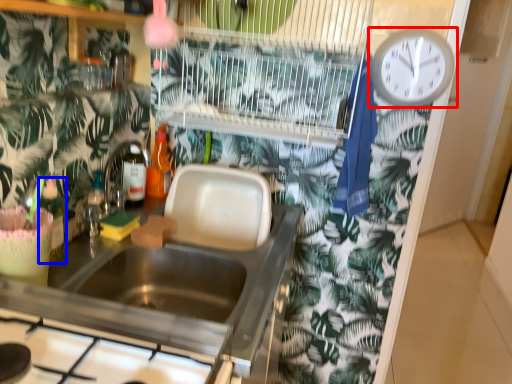
Question: Which object is further to the camera taking this photo, wall clock (highlighted by a red box) or bottle (highlighted by a blue box)?

Choices:
 (A) wall clock
 (B) bottle

Answer: (A)